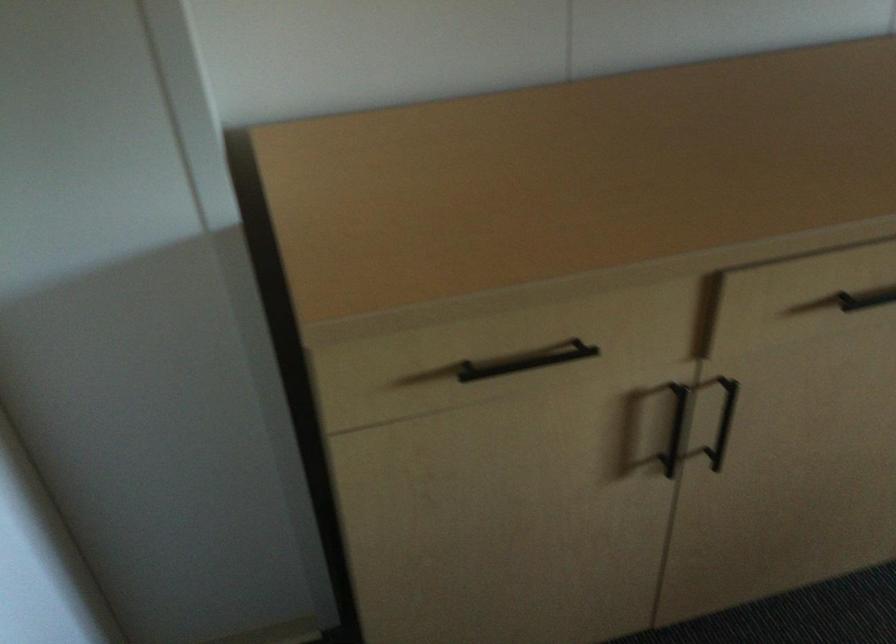
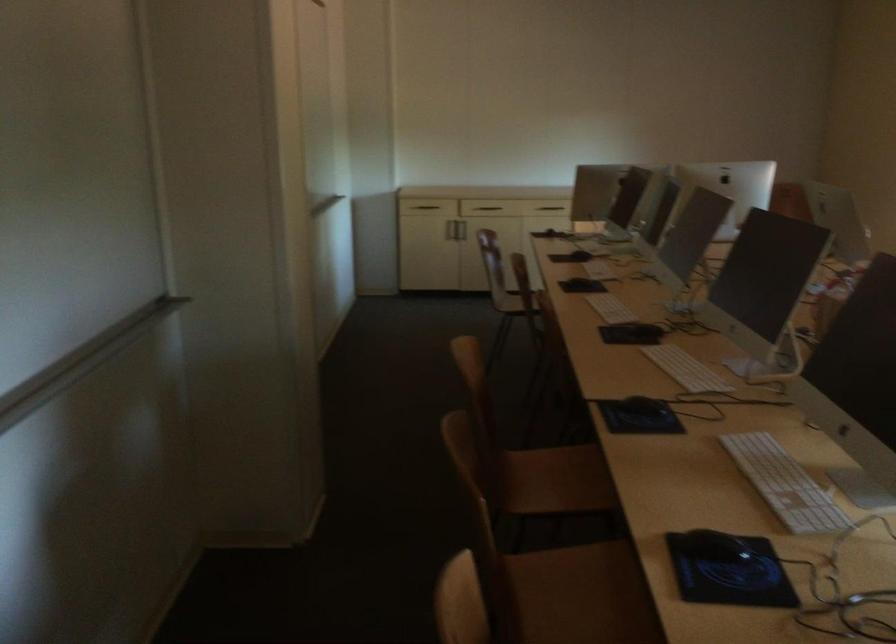
Question: I am providing you with two images of the same scene from different viewpoints. Which of the following objects are not visible in image2?

Choices:
 (A) dark drawer handle
 (B) clothes drying rack
 (C) black cabinet handle
 (D) metal cabinet handle

Answer: (C)